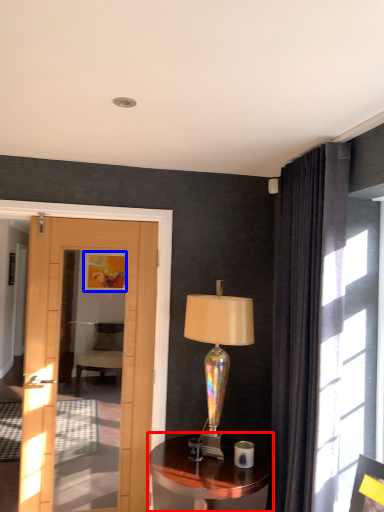
Question: Which object is further to the camera taking this photo, table (highlighted by a red box) or picture frame (highlighted by a blue box)?

Choices:
 (A) table
 (B) picture frame

Answer: (B)